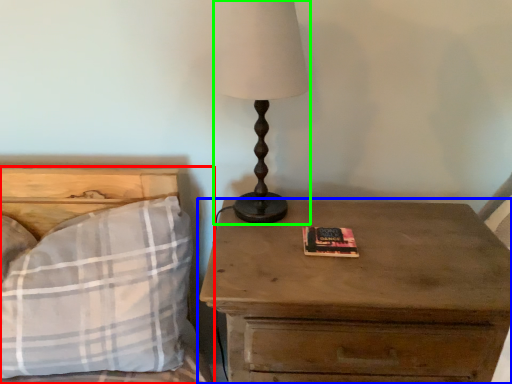
Question: Based on their relative distances, which object is farther from bed (highlighted by a red box)? Choose from nightstand (highlighted by a blue box) and table lamp (highlighted by a green box).

Choices:
 (A) nightstand
 (B) table lamp

Answer: (A)